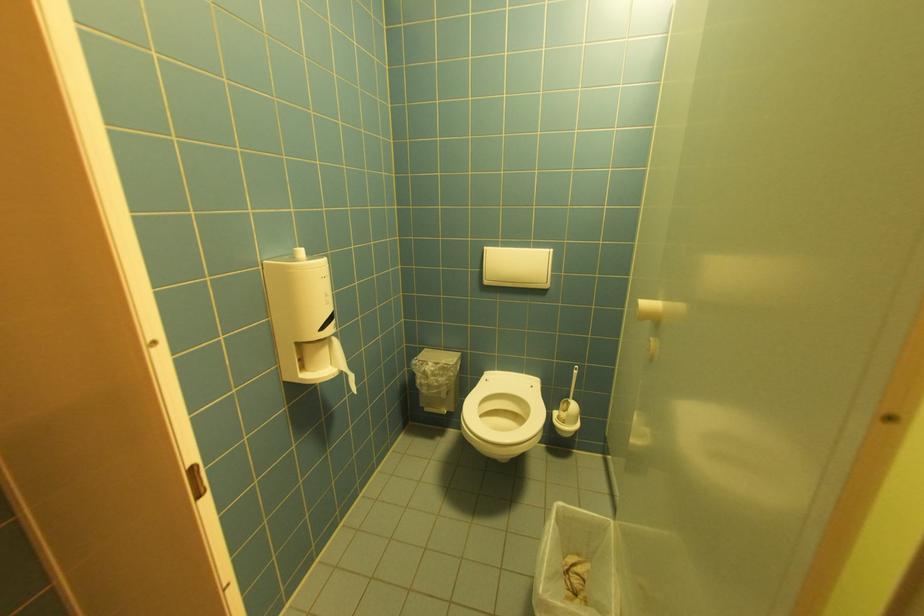
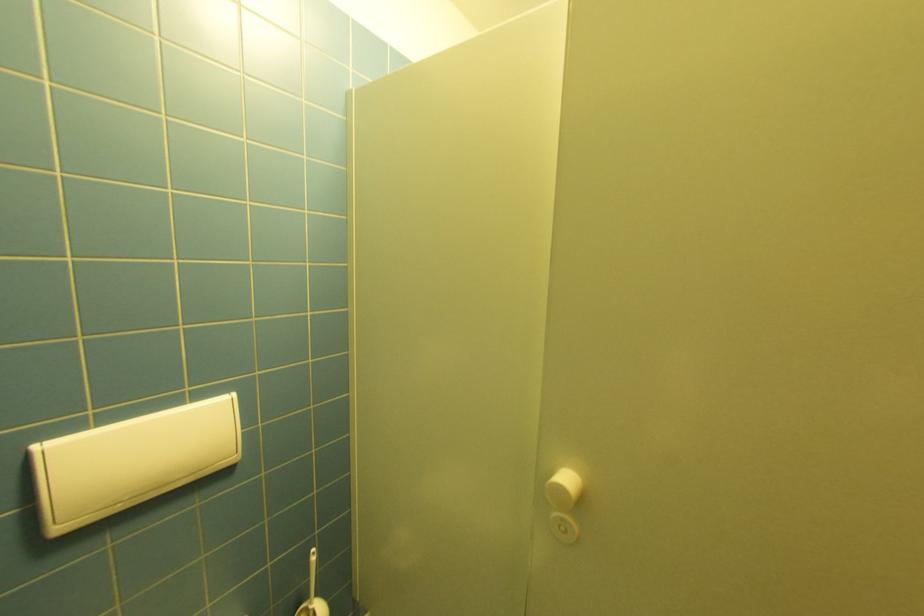
Question: The camera is either moving clockwise (left) or counter-clockwise (right) around the object. The first image is from the beginning of the video and the second image is from the end. Is the camera moving left or right when shooting the video?

Choices:
 (A) Left
 (B) Right

Answer: (A)